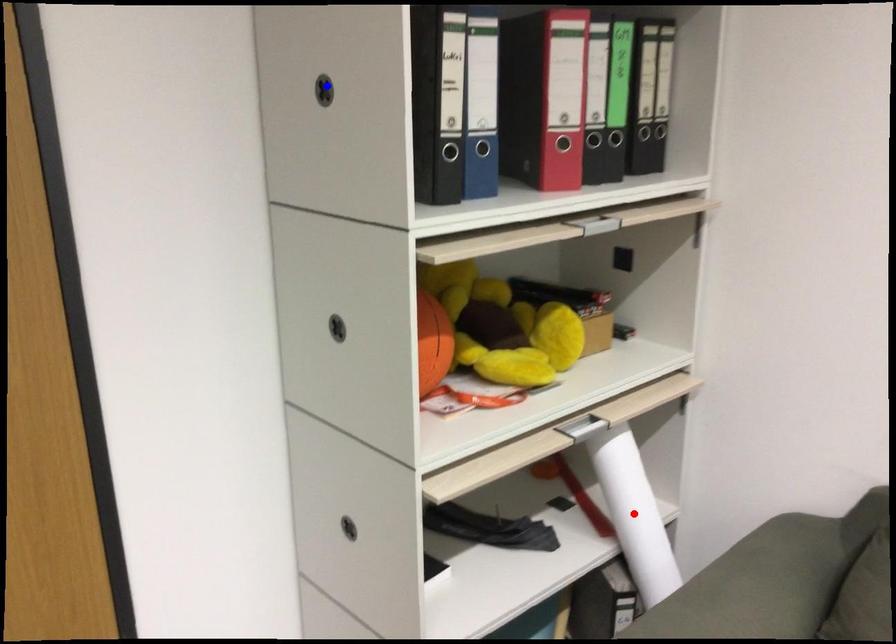
Question: Two points are marked on the image. Which point is closer to the camera?

Choices:
 (A) Blue point is closer.
 (B) Red point is closer.

Answer: (A)